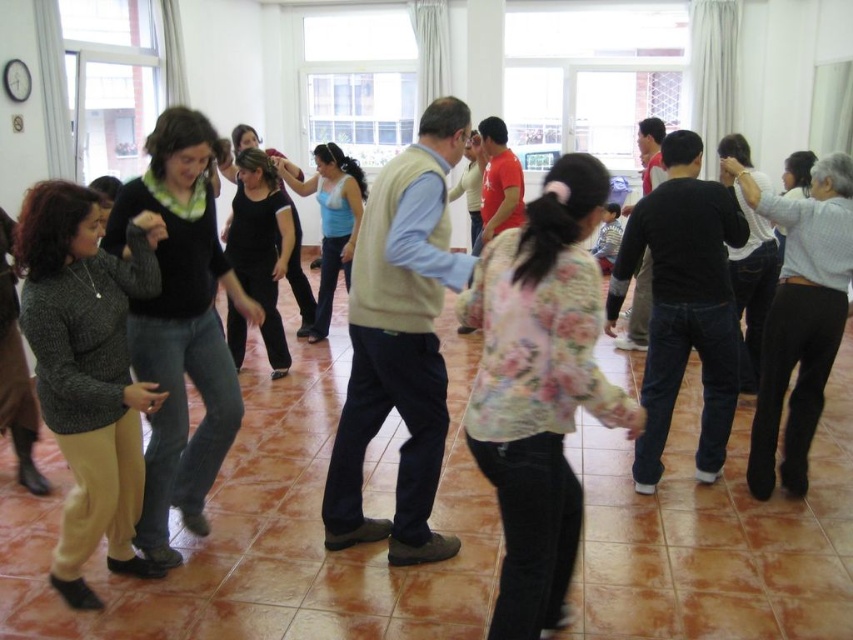
Who is higher up, light beige vest at center or knitted gray sweater at left?

Positioned higher is light beige vest at center.

At what (x,y) coordinates should I click in order to perform the action: click on light beige vest at center. Please return your answer as a coordinate pair (x, y). The width and height of the screenshot is (853, 640). Looking at the image, I should click on (399, 342).

Is point (413, 432) closer to camera compared to point (144, 296)?

No, (413, 432) is further to viewer.

The height and width of the screenshot is (640, 853). Find the location of `light beige vest at center`. light beige vest at center is located at coordinates (399, 342).

Which is above, matte black sweater at center or light blue jersey at center?

light blue jersey at center is higher up.

Can you confirm if matte black sweater at center is thinner than light blue jersey at center?

Yes, matte black sweater at center is thinner than light blue jersey at center.

Identify the location of matte black sweater at center. (181, 326).

Which is more to the right, floral print blouse at center or light blue jersey at center?

Positioned to the right is floral print blouse at center.

Is point (485, 244) closer to viewer compared to point (337, 209)?

Yes, it is.

The image size is (853, 640). Describe the element at coordinates (538, 388) in the screenshot. I see `floral print blouse at center` at that location.

The image size is (853, 640). What are the coordinates of `floral print blouse at center` in the screenshot? It's located at (538, 388).